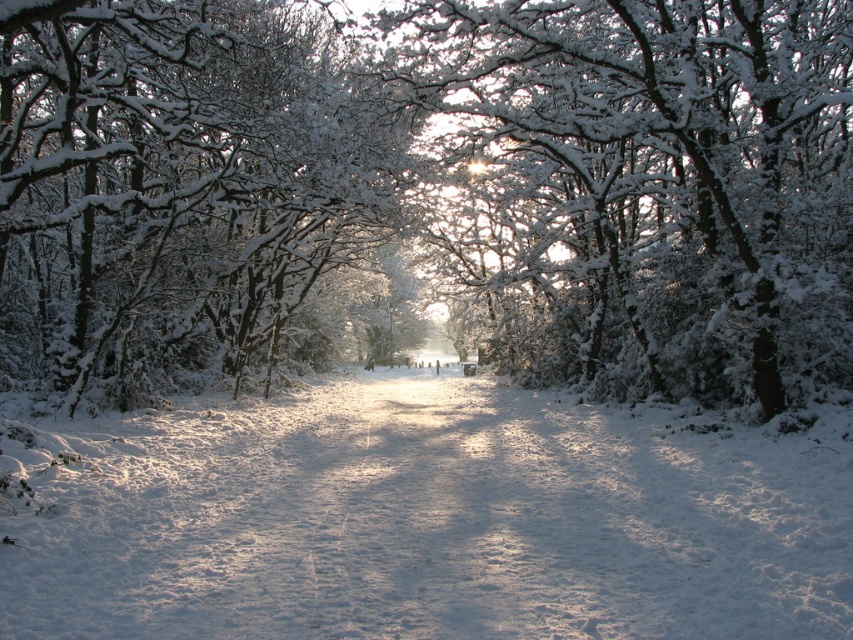
You are an observer standing in the middle of the path. You notice two elements at the center of the image. Which one is smaller in size between the white snow at center and the white frosty branches at center?

The white snow at center is smaller in size compared to the white frosty branches at center.